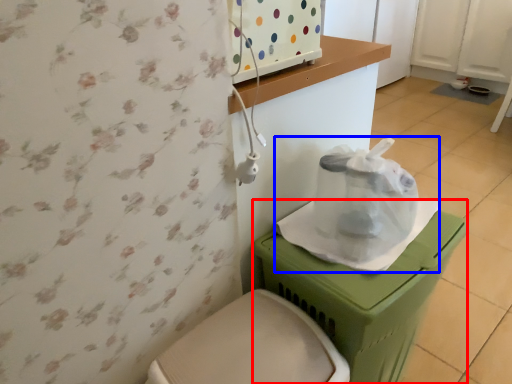
Question: Among these objects, which one is farthest to the camera, potty (highlighted by a red box) or paper bag (highlighted by a blue box)?

Choices:
 (A) potty
 (B) paper bag

Answer: (B)